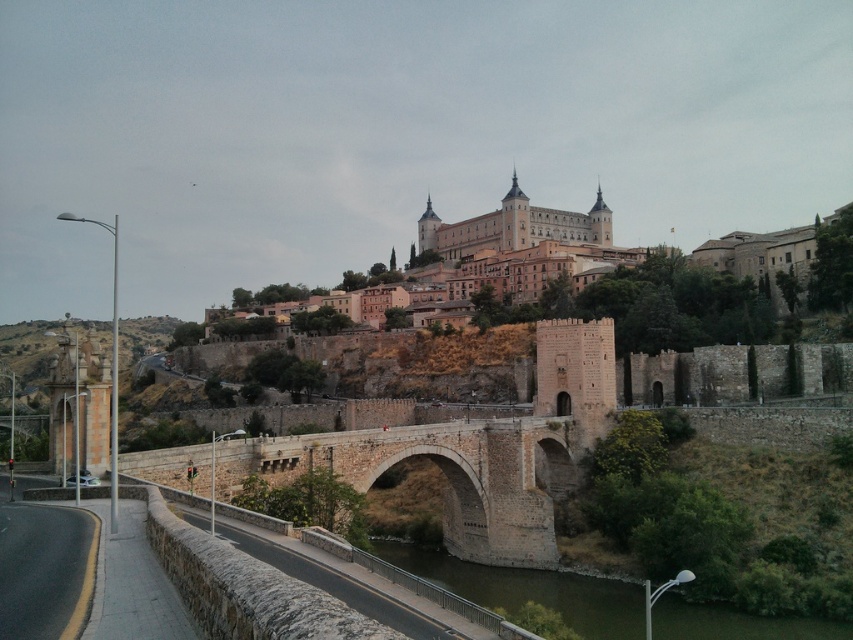
You are standing at the point marked as point (529, 589) in the image. What do you see directly in front of you?

You see greenish brown water at lower center directly in front of you.

You are standing at the point with coordinates point (624, 612) and want to walk to point (560, 224). Which direction should you move to get closer to your destination?

To move from point (624, 612) to point (560, 224), you should move toward the lower left direction since point (560, 224) is further away from the viewer compared to your current position at point (624, 612).